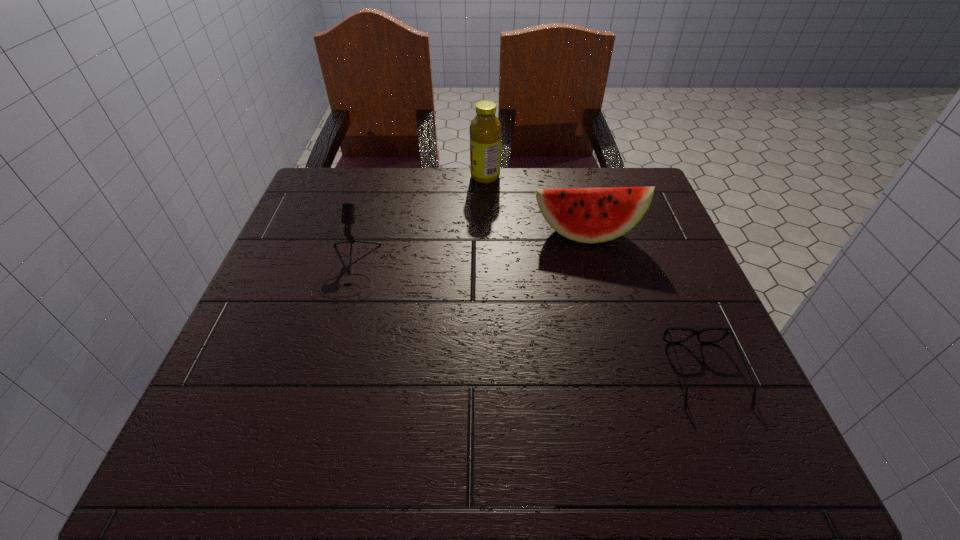
This screenshot has height=540, width=960. Identify the location of the farthest object. (485, 131).

Where is `the second object from left to right`? The height and width of the screenshot is (540, 960). the second object from left to right is located at coordinates (485, 131).

The image size is (960, 540). I want to click on watermelon, so click(588, 215).

Identify the location of the second shortest object. (348, 209).

Identify the location of microphone. [x=348, y=209].

Find the location of a particular element. This screenshot has height=540, width=960. spectacles is located at coordinates (728, 330).

This screenshot has width=960, height=540. I want to click on the shortest object, so click(728, 330).

The height and width of the screenshot is (540, 960). Identify the location of free location located 0.310m on the front label of the farthest object. (358, 177).

This screenshot has height=540, width=960. I want to click on free space located on the front label of the farthest object, so click(391, 177).

What are the coordinates of `free space located on the front label of the farthest object` in the screenshot? It's located at (387, 177).